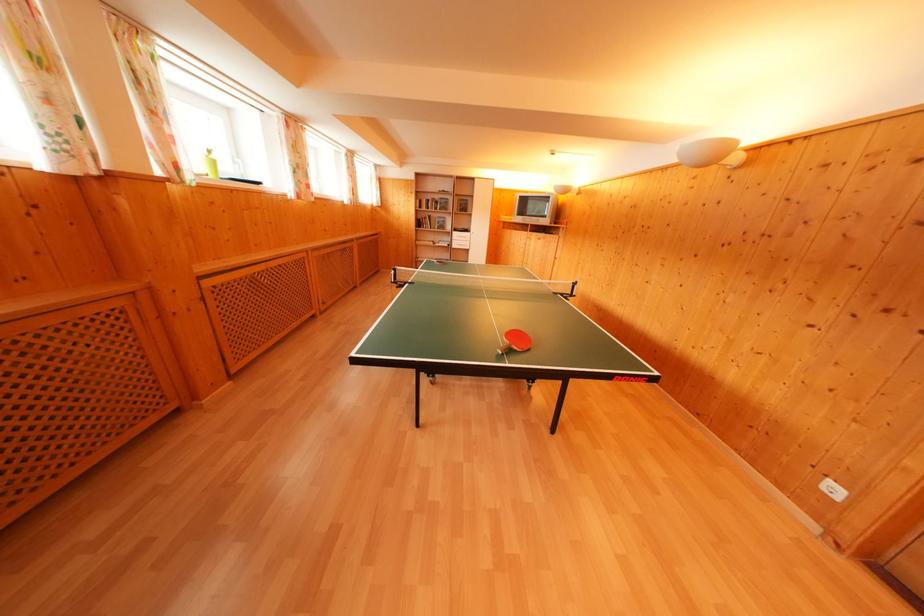
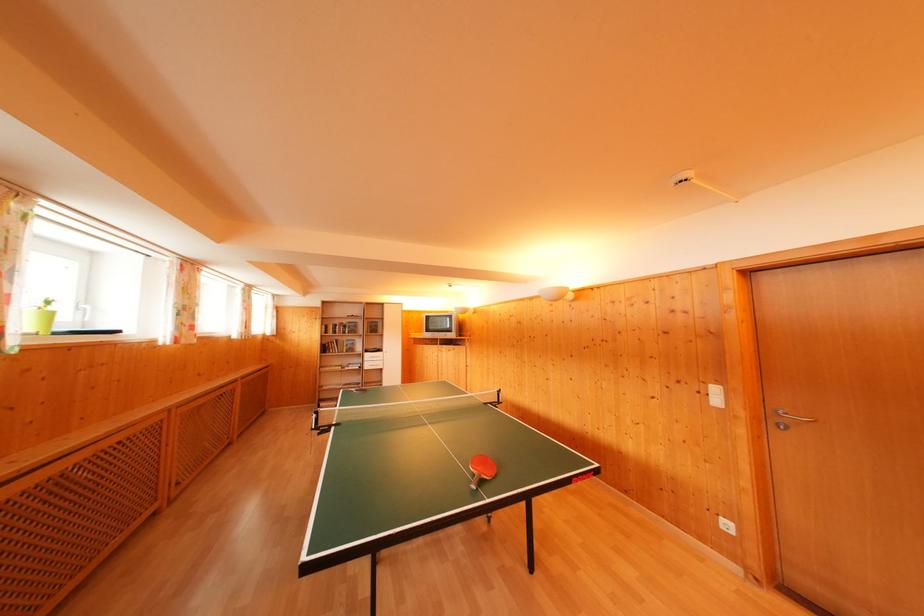
Find the pixel in the second image that matches point (426, 207) in the first image.

(331, 333)